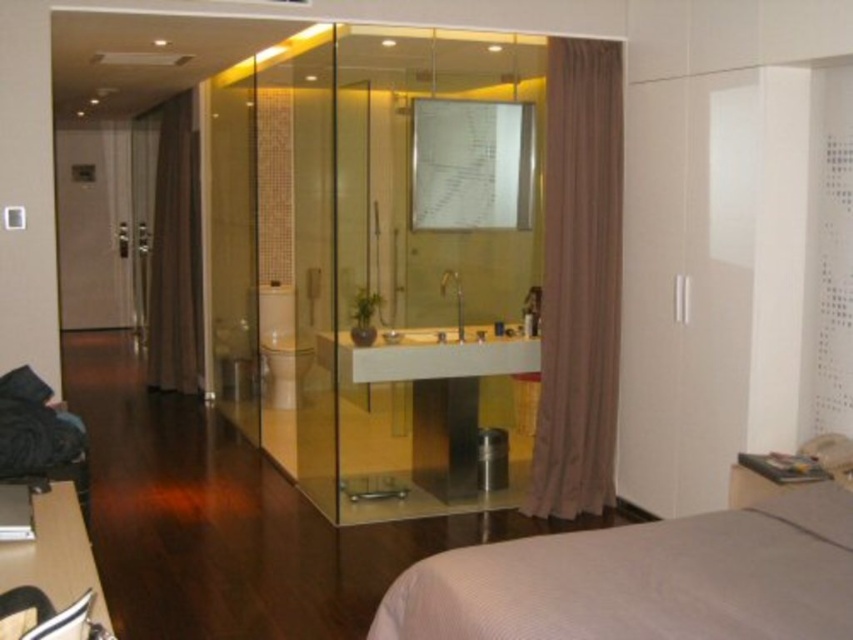
Does gray fabric bed at lower right have a smaller size compared to brown fabric curtain at left?

Yes, gray fabric bed at lower right is smaller than brown fabric curtain at left.

Who is positioned more to the left, gray fabric bed at lower right or brown fabric curtain at left?

From the viewer's perspective, brown fabric curtain at left appears more on the left side.

This screenshot has width=853, height=640. I want to click on gray fabric bed at lower right, so (643, 579).

Who is positioned more to the right, brown sheer curtain at right or matte brown door at left?

Positioned to the right is brown sheer curtain at right.

In the scene shown: Is brown sheer curtain at right further to the viewer compared to matte brown door at left?

No, brown sheer curtain at right is in front of matte brown door at left.

The height and width of the screenshot is (640, 853). What do you see at coordinates (579, 280) in the screenshot? I see `brown sheer curtain at right` at bounding box center [579, 280].

At what (x,y) coordinates should I click in order to perform the action: click on brown sheer curtain at right. Please return your answer as a coordinate pair (x, y). The image size is (853, 640). Looking at the image, I should click on coord(579,280).

Does brown sheer curtain at right have a greater height compared to brown fabric curtain at left?

No.

In the scene shown: Who is more forward, (556, 324) or (189, 243)?

Positioned in front is point (556, 324).

Where is `brown sheer curtain at right`? Image resolution: width=853 pixels, height=640 pixels. brown sheer curtain at right is located at coordinates (579, 280).